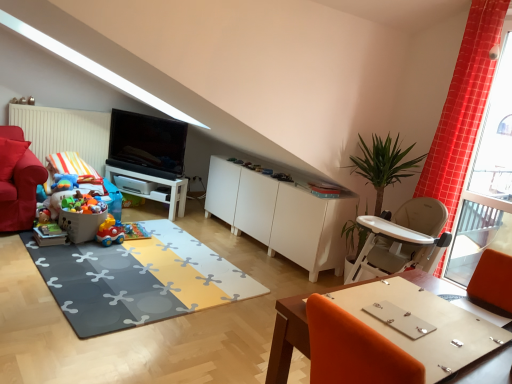
Where is `free space in front of plastic toy car at lower left, which is the 3th toy in bottom-to-top order`? free space in front of plastic toy car at lower left, which is the 3th toy in bottom-to-top order is located at coordinates (83, 250).